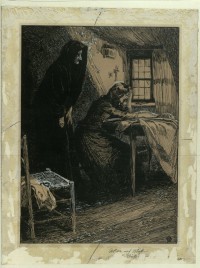
This screenshot has height=268, width=200. I want to click on frame, so click(14, 128).